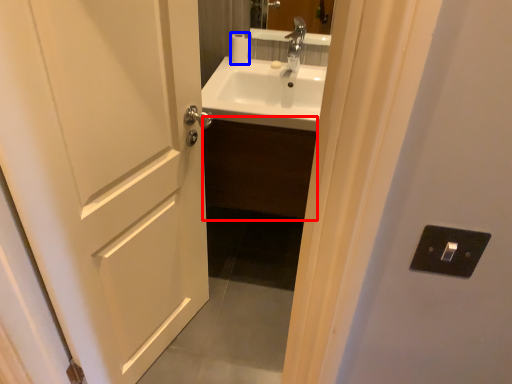
Question: Which of the following is the farthest to the observer, cabinetry (highlighted by a red box) or toilet paper (highlighted by a blue box)?

Choices:
 (A) cabinetry
 (B) toilet paper

Answer: (B)